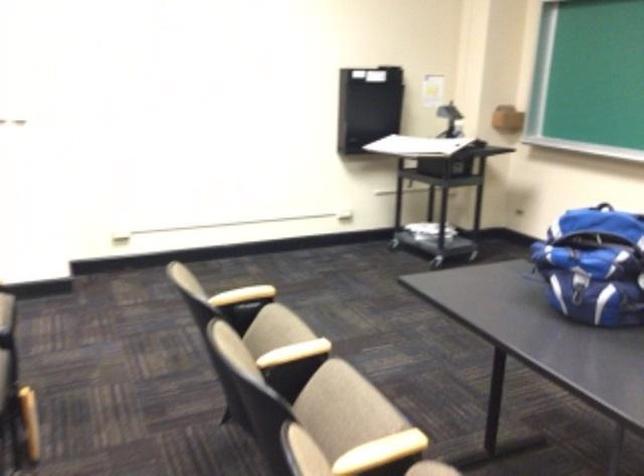
The images are taken continuously from a first-person perspective. In which direction is your viewpoint rotating?

The camera's rotation is toward right-down.